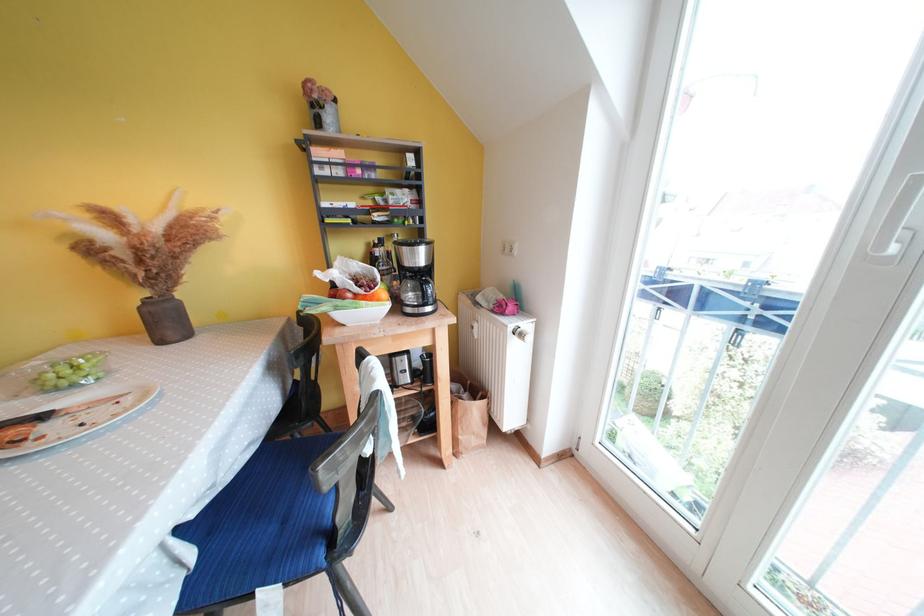
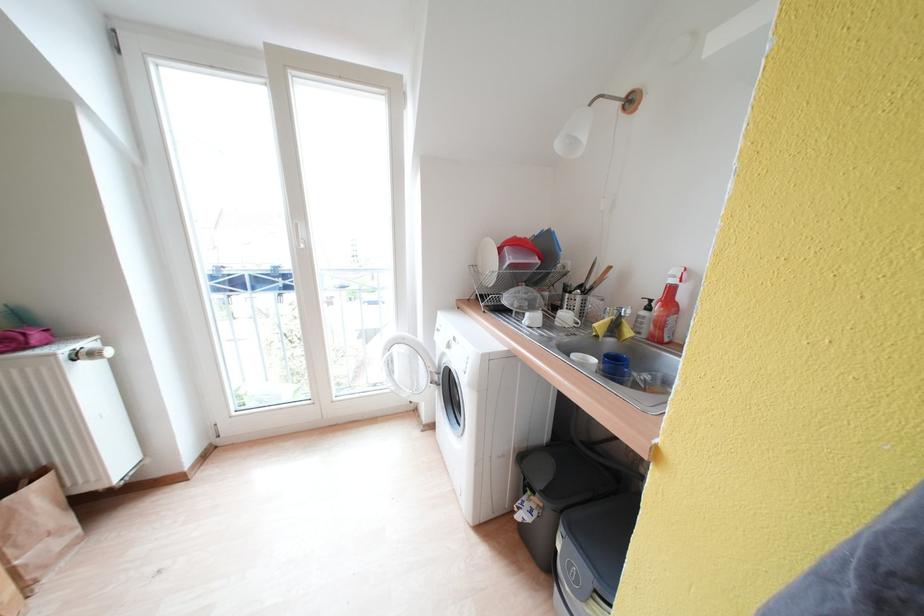
Find the pixel in the second image that matches (x=508, y=317) in the first image.

(30, 351)